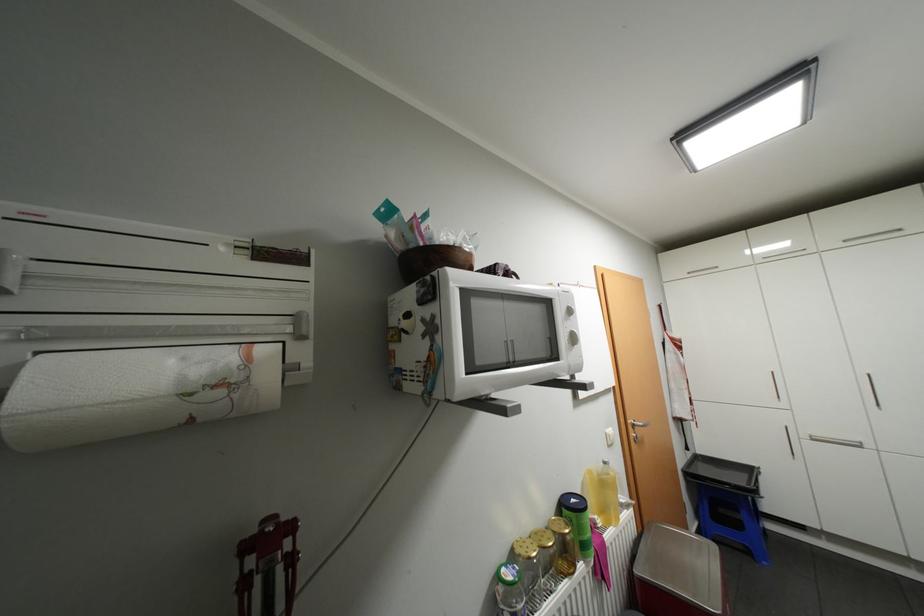
Locate an element on the screen. metal trash can lid is located at coordinates (677, 573).